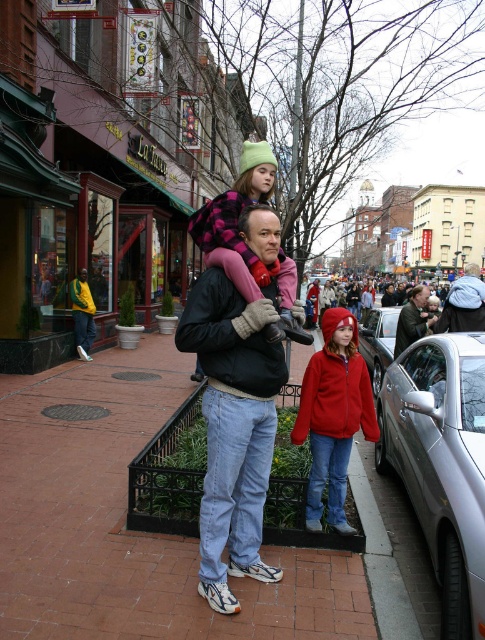
Question: Which object is positioned closest to the silver metallic car at right?

Choices:
 (A) matte black jacket at center
 (B) brick pavement at center
 (C) yellow-green jacket at left
 (D) dark blue knit hat at center

Answer: (D)

Question: Considering the real-world distances, which object is farthest from the yellow-green jacket at left?

Choices:
 (A) red fleece jacket at center
 (B) silver metallic car at right
 (C) silver metallic car at center
 (D) plush pink coat at center

Answer: (D)

Question: Does red fleece jacket at center appear on the right side of green leather jacket at center?

Choices:
 (A) yes
 (B) no

Answer: (B)

Question: Is red fleece jacket at center thinner than plush pink coat at center?

Choices:
 (A) no
 (B) yes

Answer: (A)

Question: Which point is closer to the camera?

Choices:
 (A) black jacket at center
 (B) dark blue knit hat at center
 (C) yellow-green jacket at left

Answer: (A)

Question: In this image, where is black jacket at center located relative to yellow-green jacket at left?

Choices:
 (A) right
 (B) left

Answer: (A)